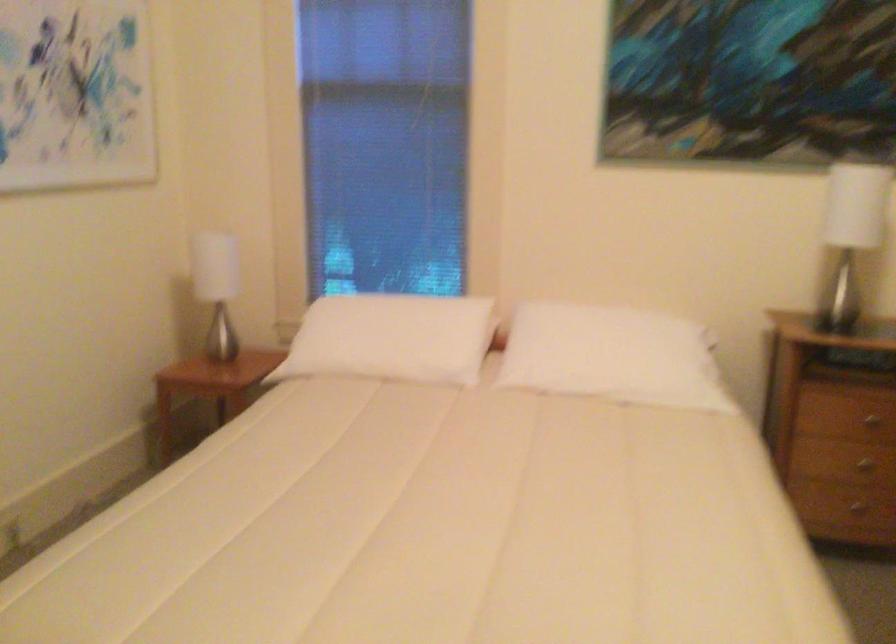
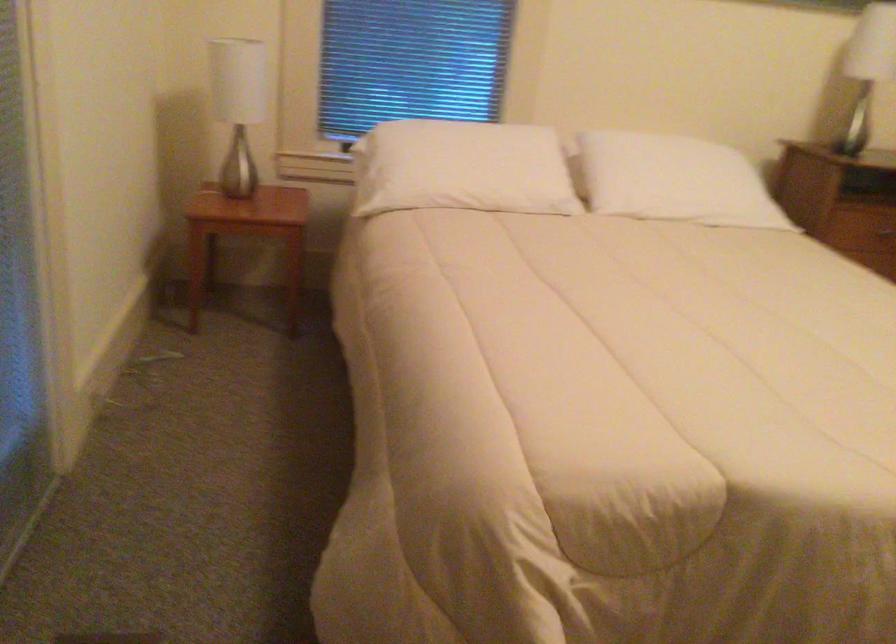
Locate, in the second image, the point that corresponds to the point at 590,364 in the first image.

(673, 180)